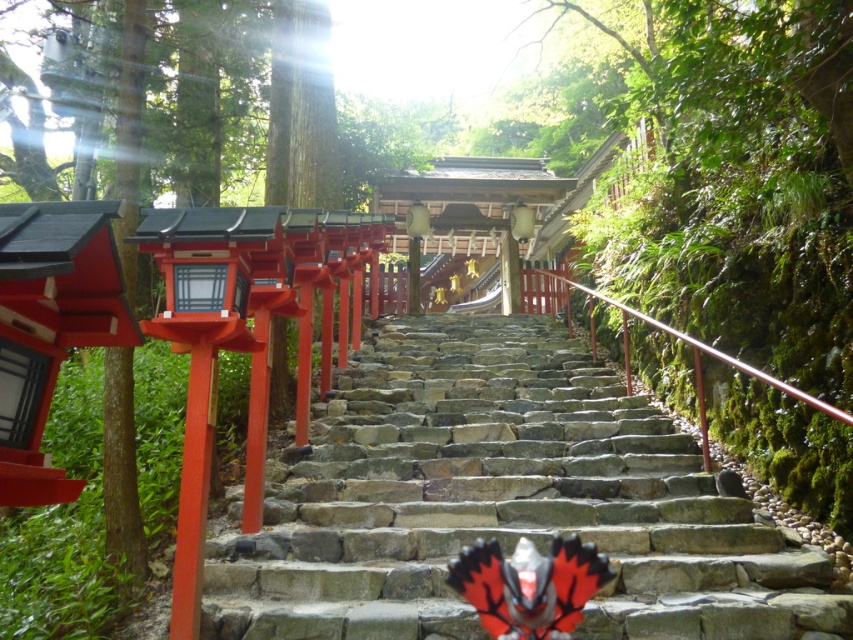
Can you confirm if stone at center is smaller than shiny metallic butterfly at center?

Actually, stone at center might be larger than shiny metallic butterfly at center.

Is stone at center taller than shiny metallic butterfly at center?

Indeed, stone at center has a greater height compared to shiny metallic butterfly at center.

In order to click on stone at center in this screenshot , I will do `click(503, 502)`.

Who is more forward, (619,529) or (422,216)?

Point (619,529) is in front.

Between point (651, 538) and point (408, 225), which one is positioned in front?

Positioned in front is point (651, 538).

This screenshot has height=640, width=853. What are the coordinates of `stone at center` in the screenshot? It's located at (503, 502).

Can you confirm if shiny metallic butterfly at center is positioned to the right of matte black lantern at center?

Yes, shiny metallic butterfly at center is to the right of matte black lantern at center.

Does shiny metallic butterfly at center appear on the left side of matte black lantern at center?

Incorrect, shiny metallic butterfly at center is not on the left side of matte black lantern at center.

The width and height of the screenshot is (853, 640). What are the coordinates of `shiny metallic butterfly at center` in the screenshot? It's located at (527, 586).